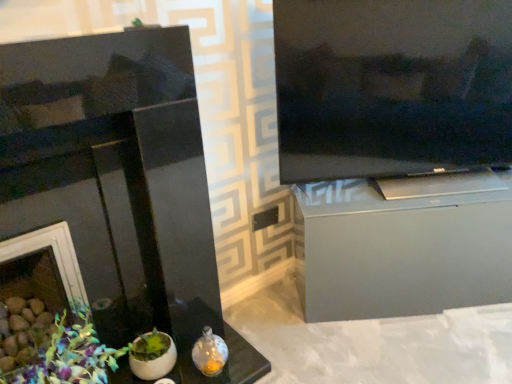
Question: Is satin silver cabinet at right touching matte green plant at lower left?

Choices:
 (A) yes
 (B) no

Answer: (B)

Question: Can matte green plant at lower left be found inside satin silver cabinet at right?

Choices:
 (A) yes
 (B) no

Answer: (B)

Question: From a real-world perspective, is satin silver cabinet at right located beneath matte green plant at lower left?

Choices:
 (A) yes
 (B) no

Answer: (B)

Question: Is satin silver cabinet at right facing towards matte green plant at lower left?

Choices:
 (A) no
 (B) yes

Answer: (A)

Question: Does satin silver cabinet at right have a lesser height compared to matte green plant at lower left?

Choices:
 (A) yes
 (B) no

Answer: (B)

Question: Considering the relative sizes of satin silver cabinet at right and matte green plant at lower left in the image provided, is satin silver cabinet at right thinner than matte green plant at lower left?

Choices:
 (A) yes
 (B) no

Answer: (A)

Question: Does black glossy fireplace at left appear on the left side of matte green plant at lower left?

Choices:
 (A) no
 (B) yes

Answer: (A)

Question: Does black glossy fireplace at left come behind matte green plant at lower left?

Choices:
 (A) no
 (B) yes

Answer: (A)

Question: Considering the relative sizes of black glossy fireplace at left and matte green plant at lower left in the image provided, is black glossy fireplace at left taller than matte green plant at lower left?

Choices:
 (A) yes
 (B) no

Answer: (A)

Question: Can you see black glossy fireplace at left touching matte green plant at lower left?

Choices:
 (A) no
 (B) yes

Answer: (A)

Question: Does black glossy fireplace at left have a greater width compared to matte green plant at lower left?

Choices:
 (A) no
 (B) yes

Answer: (A)

Question: From the image's perspective, is black glossy fireplace at left on matte green plant at lower left?

Choices:
 (A) no
 (B) yes

Answer: (B)

Question: From the image's perspective, does black glossy fireplace at left appear lower than black glossy television at upper right?

Choices:
 (A) no
 (B) yes

Answer: (B)